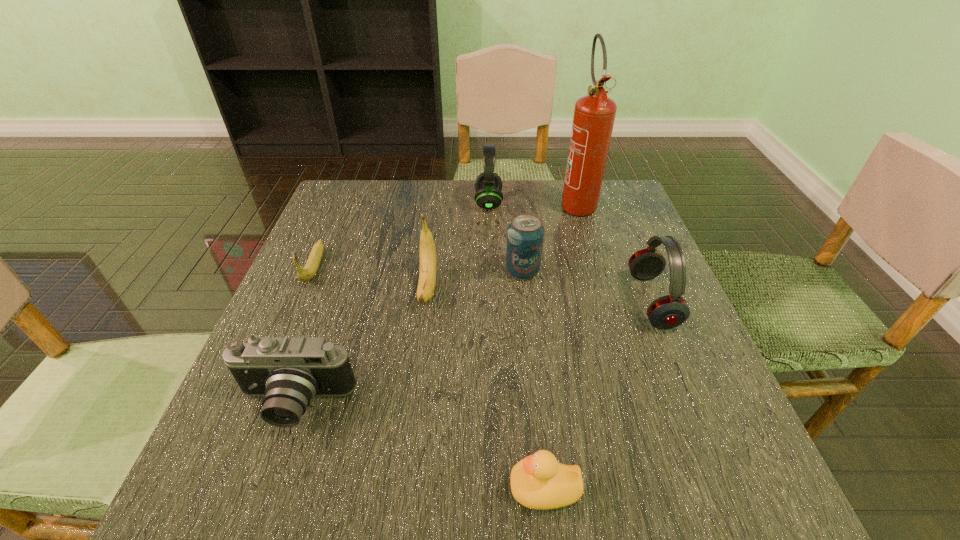
Find the location of a particular element. The height and width of the screenshot is (540, 960). blank space located at the stem of the left banana is located at coordinates (241, 438).

What are the coordinates of `vacant position located on the face of the nearest object` in the screenshot? It's located at (441, 488).

At what (x,y) coordinates should I click in order to perform the action: click on vacant space located 0.230m on the face of the nearest object. Please return your answer as a coordinate pair (x, y). Looking at the image, I should click on (350, 488).

I want to click on vacant space positioned on the face of the nearest object, so click(399, 488).

This screenshot has width=960, height=540. Identify the location of fire extinguisher at the far edge. (594, 114).

I want to click on headset at the far edge, so click(488, 185).

Find the location of `object present at the near edge`. object present at the near edge is located at coordinates (538, 481).

Where is `camera at the left edge`? The height and width of the screenshot is (540, 960). camera at the left edge is located at coordinates (289, 371).

Identify the location of banana at the left edge. The width and height of the screenshot is (960, 540). (308, 272).

Where is `fire extinguisher present at the right edge`? The height and width of the screenshot is (540, 960). fire extinguisher present at the right edge is located at coordinates (594, 114).